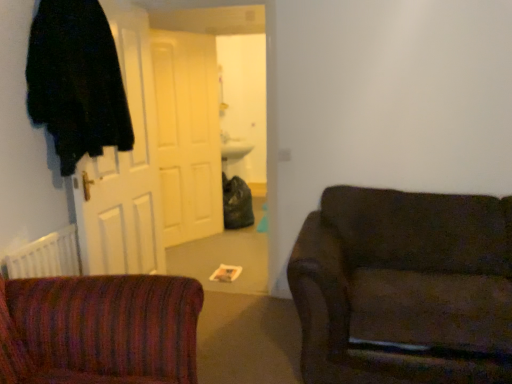
Question: Is white matte door at center, which is the 2th door from front to back, closer to camera compared to dark brown fabric couch at right?

Choices:
 (A) yes
 (B) no

Answer: (B)

Question: From the image's perspective, is white matte door at center, which is the 2th door from front to back, below dark brown fabric couch at right?

Choices:
 (A) yes
 (B) no

Answer: (B)

Question: Is white matte door at center, which is the first door from back to front, positioned behind dark brown fabric couch at right?

Choices:
 (A) yes
 (B) no

Answer: (A)

Question: Does white matte door at center, which is the first door from back to front, have a greater width compared to dark brown fabric couch at right?

Choices:
 (A) yes
 (B) no

Answer: (B)

Question: From a real-world perspective, is white matte door at center, which is the 2th door from front to back, beneath dark brown fabric couch at right?

Choices:
 (A) yes
 (B) no

Answer: (B)

Question: From a real-world perspective, relative to white matte door at center, which is the first door from back to front, is black fuzzy robe at left vertically above or below?

Choices:
 (A) above
 (B) below

Answer: (A)

Question: Considering the positions of black fuzzy robe at left and white matte door at center, which is the first door from back to front, in the image, is black fuzzy robe at left bigger or smaller than white matte door at center, which is the first door from back to front,?

Choices:
 (A) small
 (B) big

Answer: (A)

Question: Considering their positions, is black fuzzy robe at left located in front of or behind white matte door at center, which is the first door from back to front?

Choices:
 (A) behind
 (B) front

Answer: (B)

Question: Does point (53, 31) appear closer or farther from the camera than point (175, 185)?

Choices:
 (A) closer
 (B) farther

Answer: (A)

Question: From the image's perspective, is dark brown fabric couch at right located above or below black fuzzy robe at left?

Choices:
 (A) above
 (B) below

Answer: (B)

Question: Relative to black fuzzy robe at left, is dark brown fabric couch at right in front or behind?

Choices:
 (A) behind
 (B) front

Answer: (B)

Question: Is dark brown fabric couch at right wider or thinner than black fuzzy robe at left?

Choices:
 (A) wide
 (B) thin

Answer: (A)

Question: Considering the positions of point (386, 342) and point (126, 104), is point (386, 342) closer or farther from the camera than point (126, 104)?

Choices:
 (A) closer
 (B) farther

Answer: (A)

Question: From a real-world perspective, is white matte door at center, which is the 2th door from front to back, positioned above or below white wooden door at left, positioned as the 1th door in front-to-back order?

Choices:
 (A) below
 (B) above

Answer: (A)

Question: Is white matte door at center, which is the 2th door from front to back, taller or shorter than white wooden door at left, the second door in the back-to-front sequence?

Choices:
 (A) tall
 (B) short

Answer: (A)